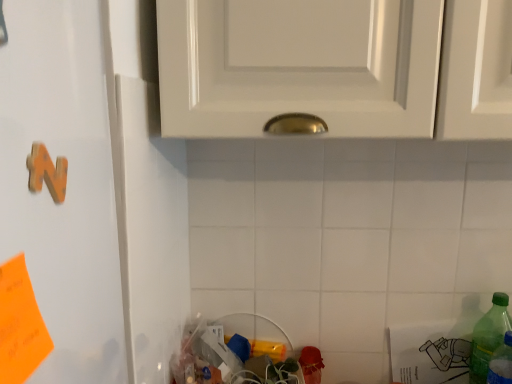
Question: Should I look upward or downward to see green plastic bottle at lower right?

Choices:
 (A) down
 (B) up

Answer: (A)